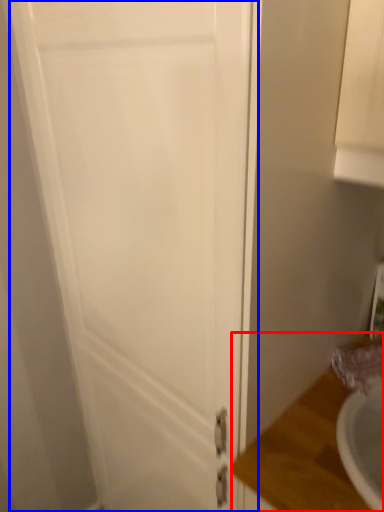
Question: Which object appears farthest to the camera in this image, counter top (highlighted by a red box) or door (highlighted by a blue box)?

Choices:
 (A) counter top
 (B) door

Answer: (A)